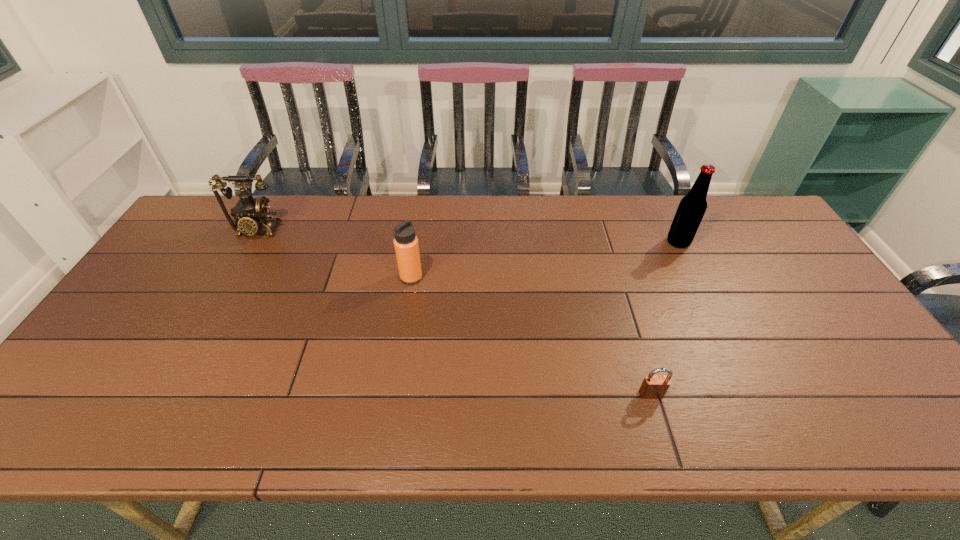
Find the location of a particular element. beer bottle is located at coordinates (692, 207).

Image resolution: width=960 pixels, height=540 pixels. In order to click on the tallest object in this screenshot , I will do `click(692, 207)`.

Where is `the leftmost object`? The height and width of the screenshot is (540, 960). the leftmost object is located at coordinates (253, 212).

Find the location of a particular element. The width and height of the screenshot is (960, 540). the second nearest object is located at coordinates (406, 245).

Locate an element on the screen. This screenshot has width=960, height=540. thermos bottle is located at coordinates (406, 245).

Where is `padlock`? The image size is (960, 540). padlock is located at coordinates (653, 387).

Where is `the nearest object`? The height and width of the screenshot is (540, 960). the nearest object is located at coordinates (653, 387).

The height and width of the screenshot is (540, 960). Find the location of `free space located 0.360m on the front of the rightmost object`. free space located 0.360m on the front of the rightmost object is located at coordinates (728, 345).

Locate an element on the screen. free space located on the rotary dial of the telephone is located at coordinates (237, 266).

The width and height of the screenshot is (960, 540). In order to click on vacant space located on the left of the second object from left to right in this screenshot , I will do `click(335, 278)`.